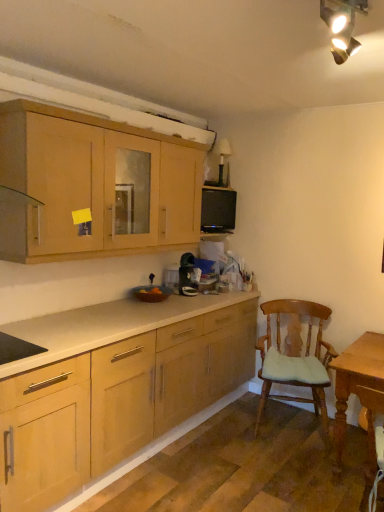
Question: Does black matte microwave at upper center lie in front of wooden cushioned chair at right?

Choices:
 (A) no
 (B) yes

Answer: (A)

Question: Can you confirm if black matte microwave at upper center is thinner than wooden cushioned chair at right?

Choices:
 (A) no
 (B) yes

Answer: (B)

Question: Is black matte microwave at upper center completely or partially outside of wooden cushioned chair at right?

Choices:
 (A) yes
 (B) no

Answer: (A)

Question: From a real-world perspective, is black matte microwave at upper center on top of wooden cushioned chair at right?

Choices:
 (A) yes
 (B) no

Answer: (A)

Question: Is black matte microwave at upper center directly adjacent to wooden cushioned chair at right?

Choices:
 (A) yes
 (B) no

Answer: (B)

Question: Considering the relative positions of black matte microwave at upper center and wooden cushioned chair at right in the image provided, is black matte microwave at upper center to the right of wooden cushioned chair at right from the viewer's perspective?

Choices:
 (A) no
 (B) yes

Answer: (A)

Question: From a real-world perspective, is black matte microwave at upper center under light brown wooden table at lower right?

Choices:
 (A) yes
 (B) no

Answer: (B)

Question: Considering the relative sizes of black matte microwave at upper center and light brown wooden table at lower right in the image provided, is black matte microwave at upper center smaller than light brown wooden table at lower right?

Choices:
 (A) no
 (B) yes

Answer: (B)

Question: Is black matte microwave at upper center positioned with its back to light brown wooden table at lower right?

Choices:
 (A) no
 (B) yes

Answer: (A)

Question: Is light brown wooden table at lower right surrounded by black matte microwave at upper center?

Choices:
 (A) no
 (B) yes

Answer: (A)

Question: Is black matte microwave at upper center positioned behind light brown wooden table at lower right?

Choices:
 (A) yes
 (B) no

Answer: (A)

Question: From the image's perspective, is black matte microwave at upper center beneath light brown wooden table at lower right?

Choices:
 (A) yes
 (B) no

Answer: (B)

Question: From a real-world perspective, is matte wood cabinets at upper left beneath black matte microwave at upper center?

Choices:
 (A) yes
 (B) no

Answer: (B)